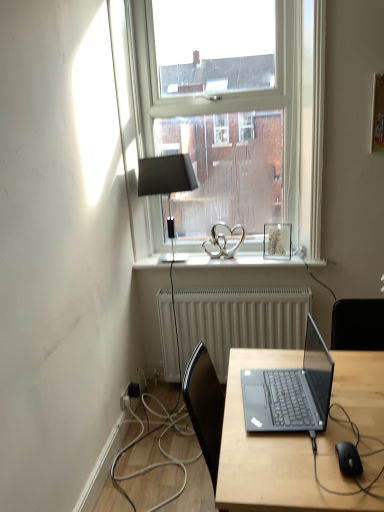
Question: Is black rubber cable at lower right outside of clear glass window at upper center?

Choices:
 (A) no
 (B) yes

Answer: (B)

Question: Is black rubber cable at lower right wider than clear glass window at upper center?

Choices:
 (A) no
 (B) yes

Answer: (B)

Question: Is black rubber cable at lower right shorter than clear glass window at upper center?

Choices:
 (A) yes
 (B) no

Answer: (A)

Question: From a real-world perspective, is black rubber cable at lower right on top of clear glass window at upper center?

Choices:
 (A) no
 (B) yes

Answer: (A)

Question: Would you consider black rubber cable at lower right to be distant from clear glass window at upper center?

Choices:
 (A) yes
 (B) no

Answer: (A)

Question: In terms of width, does white textured radiator at center look wider or thinner when compared to black rubber cable at lower right?

Choices:
 (A) wide
 (B) thin

Answer: (B)

Question: From the image's perspective, is white textured radiator at center above or below black rubber cable at lower right?

Choices:
 (A) above
 (B) below

Answer: (A)

Question: Is white textured radiator at center situated inside black rubber cable at lower right or outside?

Choices:
 (A) inside
 (B) outside

Answer: (B)

Question: From a real-world perspective, is white textured radiator at center positioned above or below black rubber cable at lower right?

Choices:
 (A) below
 (B) above

Answer: (A)

Question: Is white glossy window sill at center inside or outside of white textured radiator at center?

Choices:
 (A) inside
 (B) outside

Answer: (B)

Question: From a real-world perspective, is white glossy window sill at center physically located above or below white textured radiator at center?

Choices:
 (A) below
 (B) above

Answer: (B)

Question: Based on their positions, is white glossy window sill at center located to the left or right of white textured radiator at center?

Choices:
 (A) right
 (B) left

Answer: (B)

Question: From the image's perspective, is white glossy window sill at center positioned above or below white textured radiator at center?

Choices:
 (A) below
 (B) above

Answer: (B)

Question: From a real-world perspective, is matte black laptop at center physically located above or below matte silver picture frame at upper right?

Choices:
 (A) above
 (B) below

Answer: (B)

Question: Considering their positions, is matte black laptop at center located in front of or behind matte silver picture frame at upper right?

Choices:
 (A) front
 (B) behind

Answer: (A)